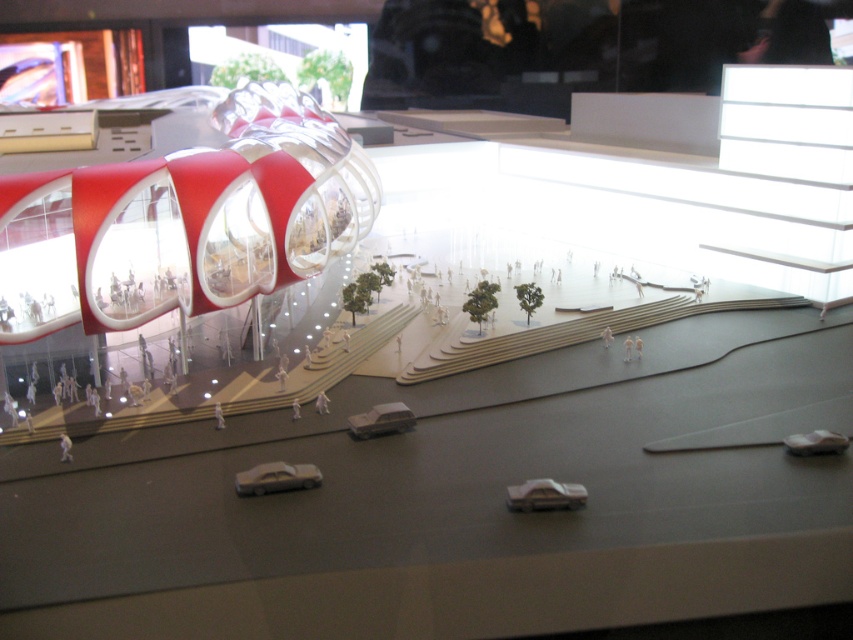
Can you confirm if white glossy toy car at lower center is wider than white matte toy car at center?

Yes.

Is point (263, 480) farther from camera compared to point (361, 433)?

No, it is not.

What do you see at coordinates (276, 477) in the screenshot? The height and width of the screenshot is (640, 853). I see `white glossy toy car at lower center` at bounding box center [276, 477].

You are a GUI agent. You are given a task and a screenshot of the screen. Output one action in this format:
    pyautogui.click(x=<x>, y=<y>)
    Task: Click on the white glossy toy car at lower center
    The width and height of the screenshot is (853, 640).
    Given the screenshot: What is the action you would take?
    pyautogui.click(x=276, y=477)

Between point (549, 486) and point (801, 444), which one is positioned in front?

Positioned in front is point (549, 486).

This screenshot has height=640, width=853. What do you see at coordinates (544, 496) in the screenshot?
I see `metallic silver car at center` at bounding box center [544, 496].

Identify the location of metallic silver car at center. (544, 496).

Who is positioned more to the right, metallic silver car at center or white matte toy car at center?

metallic silver car at center is more to the right.

Is point (548, 477) positioned before point (347, 417)?

Yes, point (548, 477) is closer to viewer.

Image resolution: width=853 pixels, height=640 pixels. What are the coordinates of `metallic silver car at center` in the screenshot? It's located at 544,496.